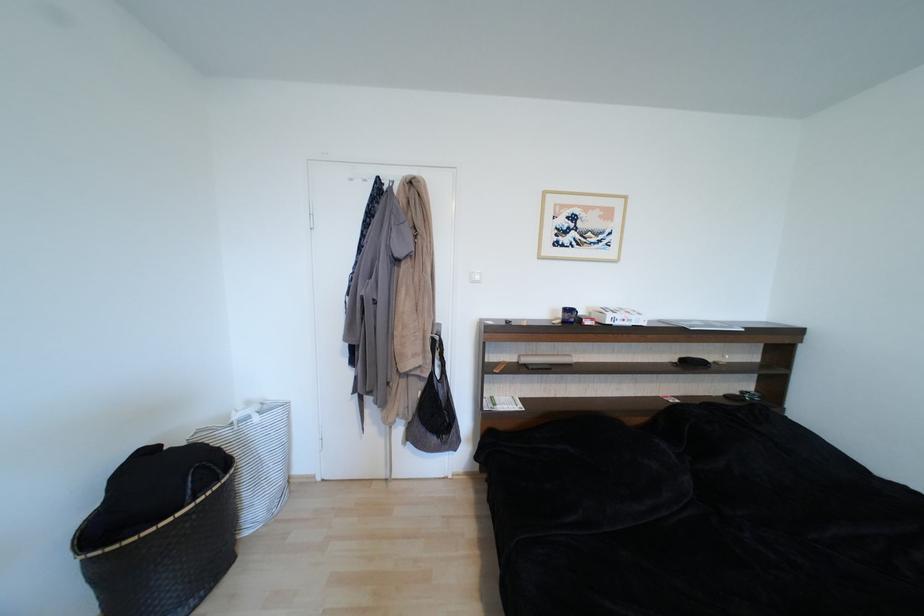
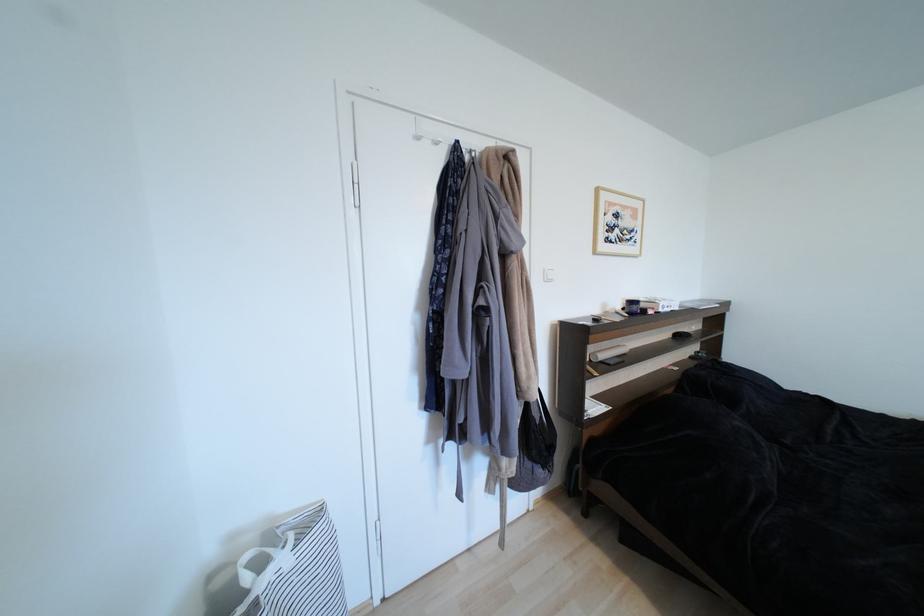
Locate, in the second image, the point that corresponds to the point at 575,312 in the first image.

(638, 304)